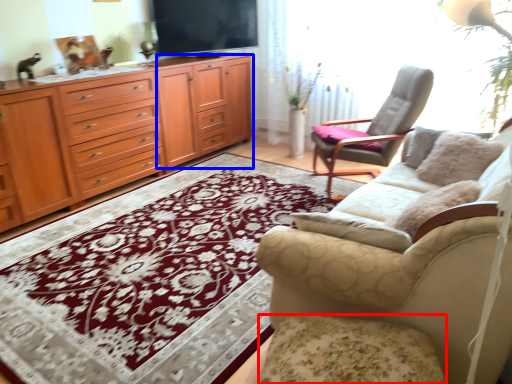
Question: Among these objects, which one is nearest to the camera, footrest (highlighted by a red box) or tv cabinet (highlighted by a blue box)?

Choices:
 (A) footrest
 (B) tv cabinet

Answer: (A)